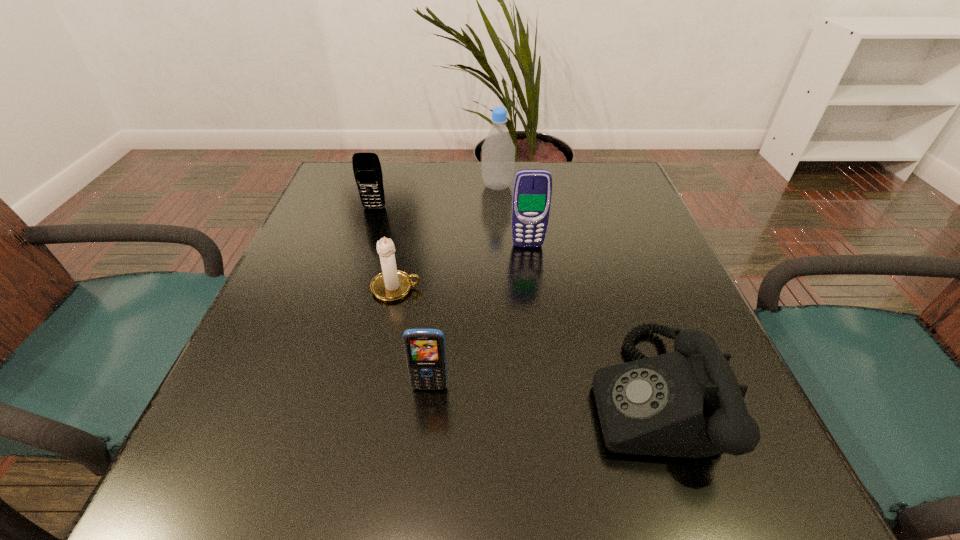
The image size is (960, 540). I want to click on bottle, so click(498, 150).

The width and height of the screenshot is (960, 540). I want to click on the rightmost cellular telephone, so click(532, 190).

Identify the location of the tallest cellular telephone. (532, 190).

Where is `the farthest cellular telephone`? The width and height of the screenshot is (960, 540). the farthest cellular telephone is located at coordinates (x=367, y=170).

Where is `the second farthest object`? the second farthest object is located at coordinates (367, 170).

Image resolution: width=960 pixels, height=540 pixels. In order to click on the nearest cellular telephone in this screenshot , I will do `click(425, 351)`.

Identify the location of the fourth object from right to left. (425, 351).

Locate an element on the screen. The image size is (960, 540). the fourth farthest object is located at coordinates (392, 284).

Locate an element on the screen. Image resolution: width=960 pixels, height=540 pixels. candle holder is located at coordinates 392,284.

This screenshot has height=540, width=960. I want to click on telephone, so click(688, 403).